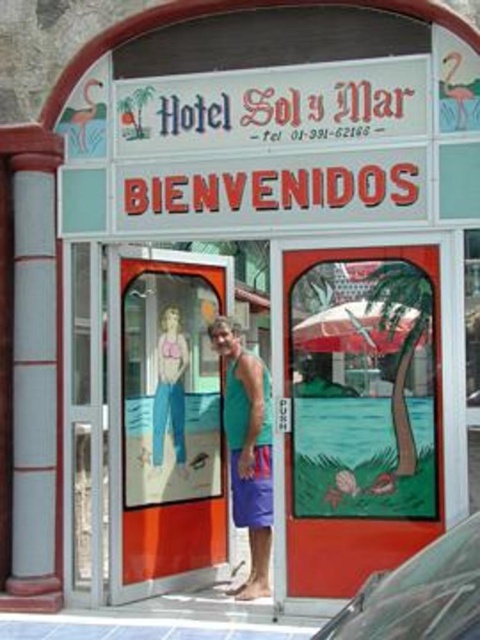
You are a guest at Hotel Sol y Mar and want to check in. You notice two fabrics on the entrance doors. The teal fabric tank top at center and the pink fabric at center. Which one is closer to the left side of the entrance doors?

The teal fabric tank top at center is closer to the left side of the entrance doors than the pink fabric at center, so the teal fabric tank top at center is on the left.

You are standing at the entrance of Hotel Sol y Mar and see a transparent plastic car. Where exactly is this car located on the left door? Please provide coordinates in the format of a point like point (419, 595).

The transparent plastic car is located at point (419, 595) on the left door.